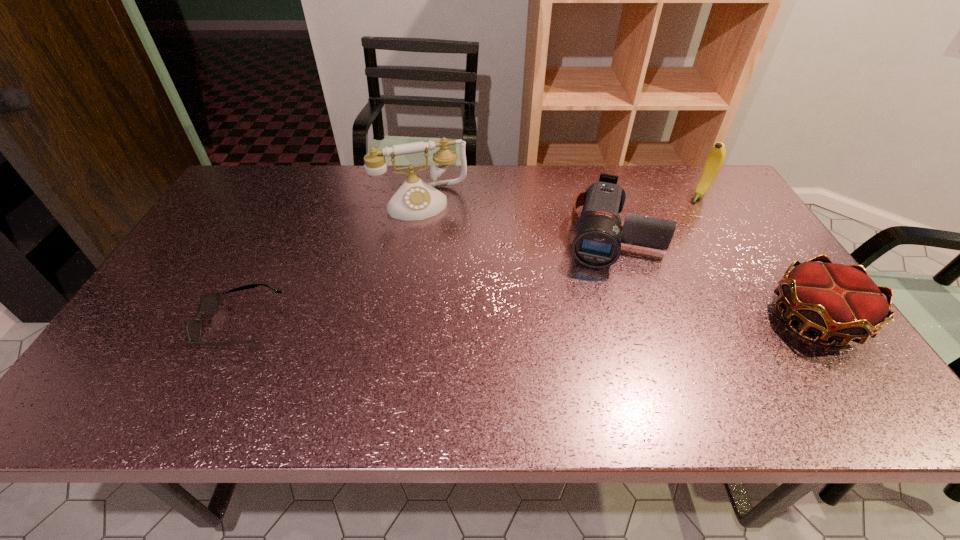
Where is `free point between the banana and the telephone`? free point between the banana and the telephone is located at coordinates (561, 199).

Find the location of `unoccupied position between the telephone and the camcorder`. unoccupied position between the telephone and the camcorder is located at coordinates (516, 218).

In order to click on vacant area that lies between the telephone and the third object from right to left in this screenshot , I will do `click(516, 218)`.

Where is `free space between the telephone and the crown`? Image resolution: width=960 pixels, height=540 pixels. free space between the telephone and the crown is located at coordinates (618, 260).

This screenshot has width=960, height=540. In order to click on object that stands as the third closest to the camcorder in this screenshot , I will do `click(415, 199)`.

Locate an element on the screen. Image resolution: width=960 pixels, height=540 pixels. the second closest object to the crown is located at coordinates (715, 158).

This screenshot has height=540, width=960. In order to click on blank area in the image that satisfies the following two spatial constraints: 1. on the front side of the telephone; 2. on the left side of the third object from right to left in this screenshot , I will do `click(416, 234)`.

Image resolution: width=960 pixels, height=540 pixels. I want to click on vacant space that satisfies the following two spatial constraints: 1. on the front side of the crown; 2. on the right side of the banana, so click(775, 318).